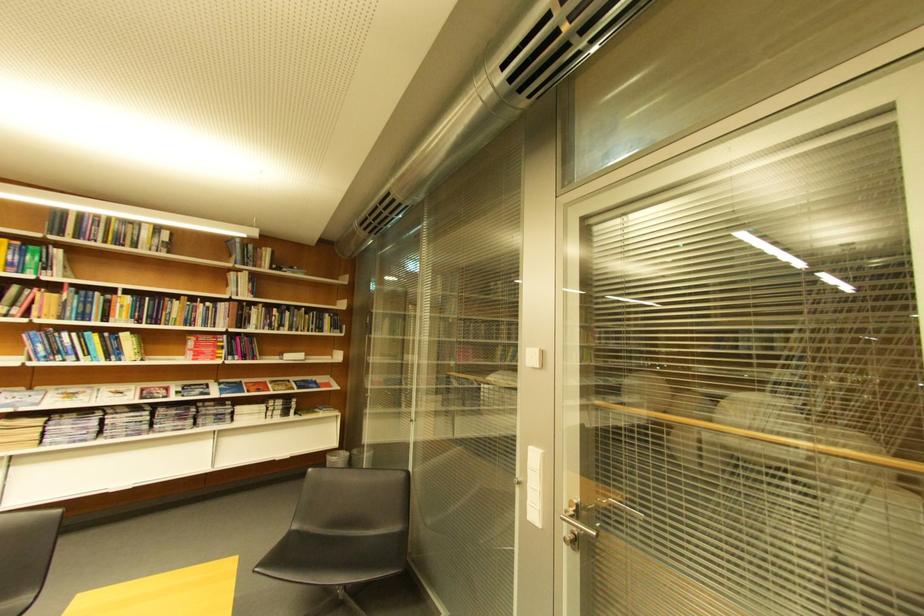
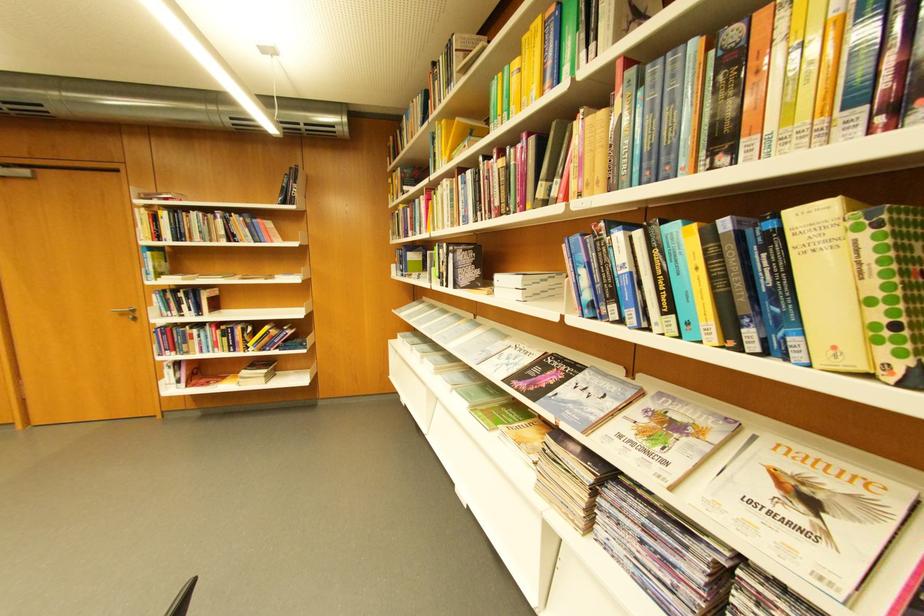
Find the pixel in the second image that matches pixel 99 357 in the first image.

(681, 310)